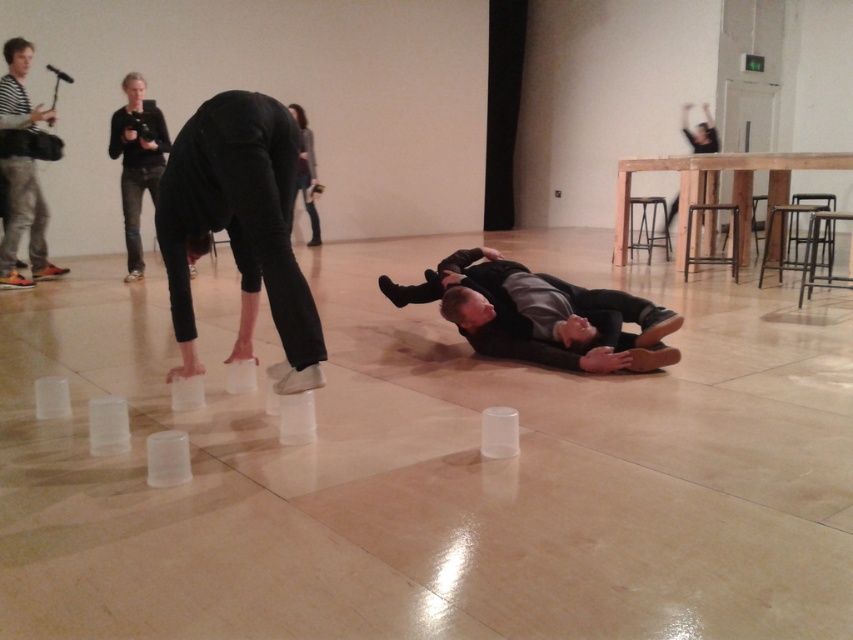
You are standing at the entrance of the gallery and see the image. There is a point marked at coordinates (239, 225). What object is located at that point?

The point at coordinates (239, 225) indicates black matte pants at center.

You are a photographer positioned at the back of the room. You want to take a photo of the black matte pants at center and the wooden stool at center right. Which object will appear larger in your photo?

The black matte pants at center will appear larger in the photo because it is closer to the viewer than the wooden stool at center right.

You are an interior designer planning to place a 1.2 meter tall sculpture in this space. Considering the black matte pants at center and the wooden stool at center right, which object should the sculpture be placed behind to ensure it is taller than both?

The sculpture should be placed behind the wooden stool at center right because the black matte pants at center is taller than the wooden stool at center right, so placing it behind the taller object ensures the sculpture will be visible above both.